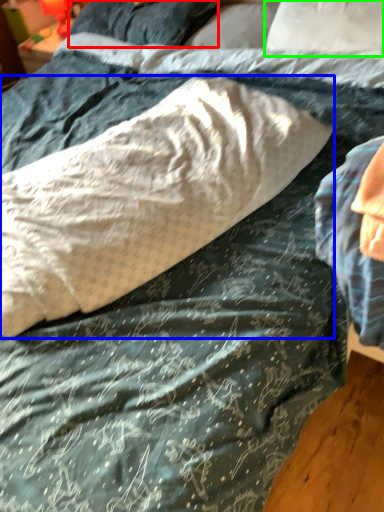
Question: Based on their relative distances, which object is nearer to pillow (highlighted by a red box)? Choose from pillow (highlighted by a blue box) and pillow (highlighted by a green box).

Choices:
 (A) pillow
 (B) pillow

Answer: (B)